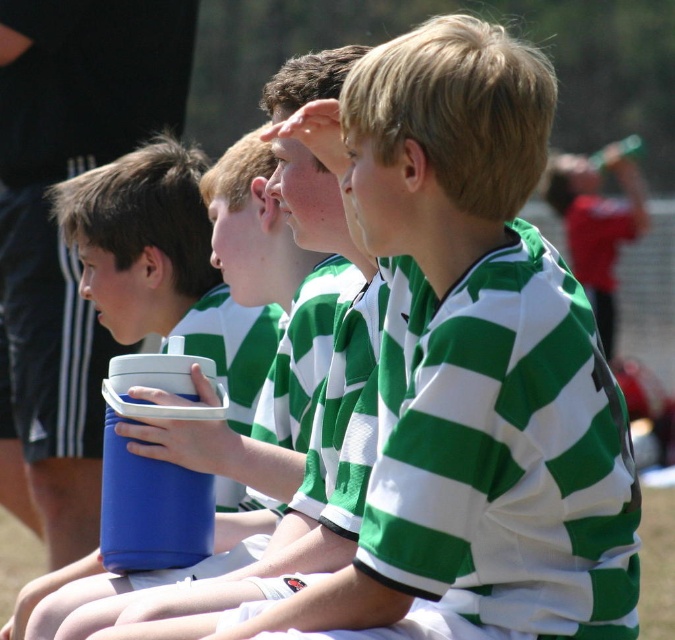
Can you confirm if blue plastic thermos at center is taller than blue plastic cooler at center?

Yes.

Can you confirm if blue plastic thermos at center is wider than blue plastic cooler at center?

Yes, blue plastic thermos at center is wider than blue plastic cooler at center.

What do you see at coordinates (163, 264) in the screenshot? Image resolution: width=675 pixels, height=640 pixels. I see `blue plastic thermos at center` at bounding box center [163, 264].

I want to click on blue plastic thermos at center, so click(x=163, y=264).